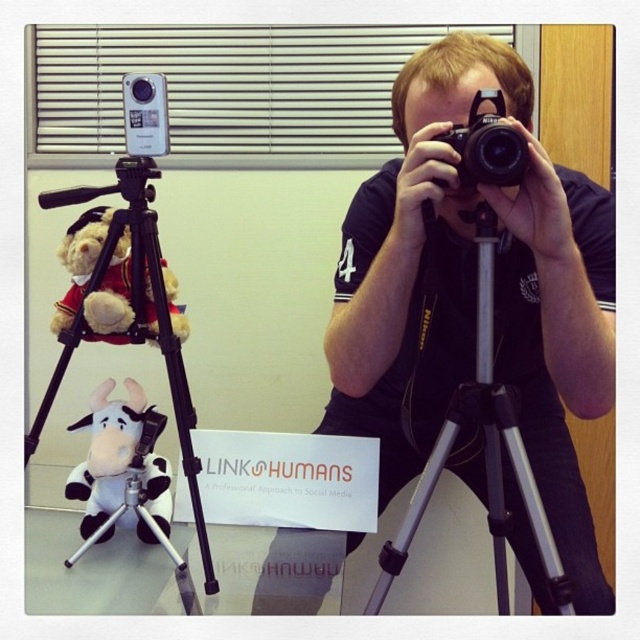
Who is shorter, silver metallic tripod at lower left or velvet teddy bear at left?

velvet teddy bear at left is shorter.

Is silver metallic tripod at lower left smaller than velvet teddy bear at left?

Actually, silver metallic tripod at lower left might be larger than velvet teddy bear at left.

This screenshot has height=640, width=640. Find the location of `silver metallic tripod at lower left`. silver metallic tripod at lower left is located at coordinates (134, 314).

The image size is (640, 640). I want to click on silver metallic tripod at lower left, so click(134, 314).

Is silver metallic tripod at lower left above white plush cow at center?

Yes.

Does silver metallic tripod at lower left have a larger size compared to white plush cow at center?

Yes.

Is point (150, 246) positioned behind point (124, 408)?

No, (150, 246) is in front of (124, 408).

The height and width of the screenshot is (640, 640). I want to click on silver metallic tripod at lower left, so click(134, 314).

Is point (376, 586) positioned in front of point (499, 106)?

No, it is behind (499, 106).

Which is above, silver metallic tripod at center or black plastic camera at center?

black plastic camera at center

At what (x,y) coordinates should I click in order to perform the action: click on silver metallic tripod at center. Please return your answer as a coordinate pair (x, y). The height and width of the screenshot is (640, 640). Looking at the image, I should click on (483, 451).

This screenshot has height=640, width=640. What are the coordinates of `silver metallic tripod at center` in the screenshot? It's located at (483, 451).